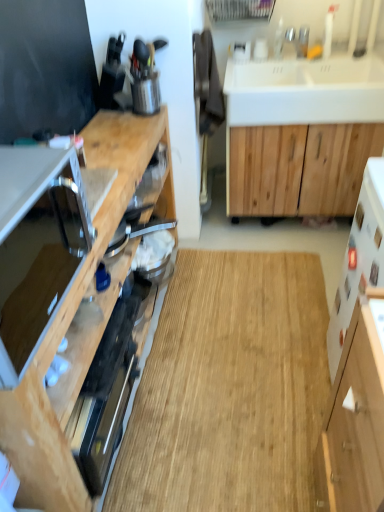
You are a GUI agent. You are given a task and a screenshot of the screen. Output one action in this format:
    pyautogui.click(x=<x>, y=<y>)
    Task: Click on the unoccupied area in front of metallic silver utensil holder at upper left, the 1th appliance in the back-to-front sequence
    The width and height of the screenshot is (384, 512).
    Given the screenshot: What is the action you would take?
    pyautogui.click(x=135, y=124)